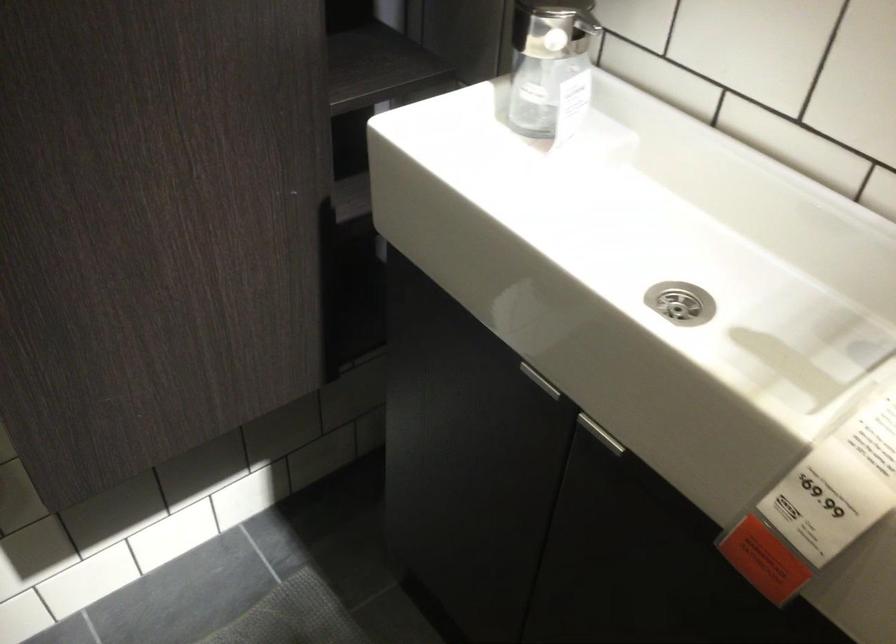
Describe the element at coordinates (547, 35) in the screenshot. The image size is (896, 644). I see `a soap dispenser pump` at that location.